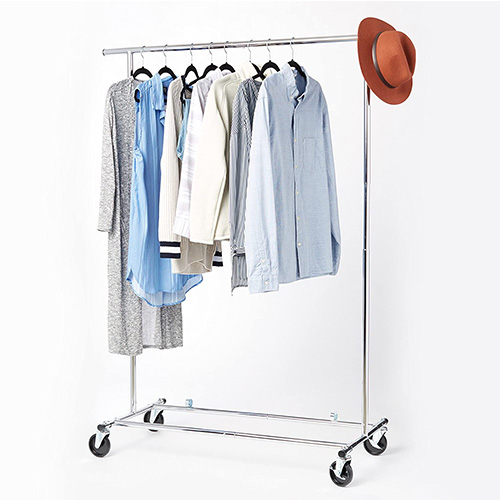
At what (x,y) coordinates should I click in order to perform the action: click on hangers. Please return your answer as a coordinate pair (x, y). Looking at the image, I should click on (297, 65), (275, 67), (256, 66), (228, 65), (194, 69), (207, 67), (165, 67), (146, 73).